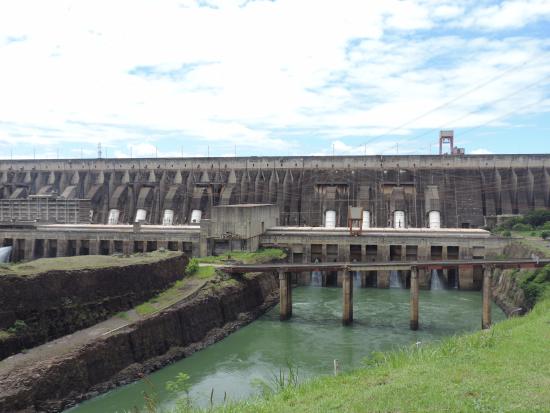
Where is `pillar`? The height and width of the screenshot is (413, 550). pillar is located at coordinates (483, 286), (412, 302), (348, 294), (280, 287).